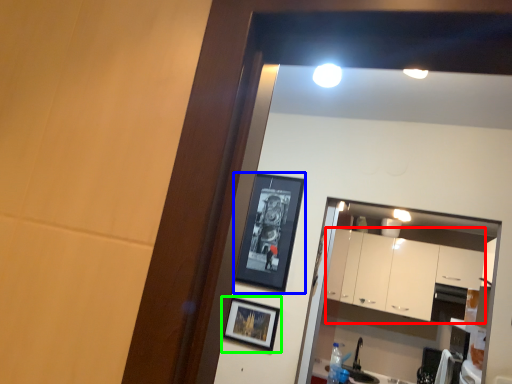
Question: Which is nearer to the cabinetry (highlighted by a red box)? picture frame (highlighted by a blue box) or picture frame (highlighted by a green box).

Choices:
 (A) picture frame
 (B) picture frame

Answer: (A)